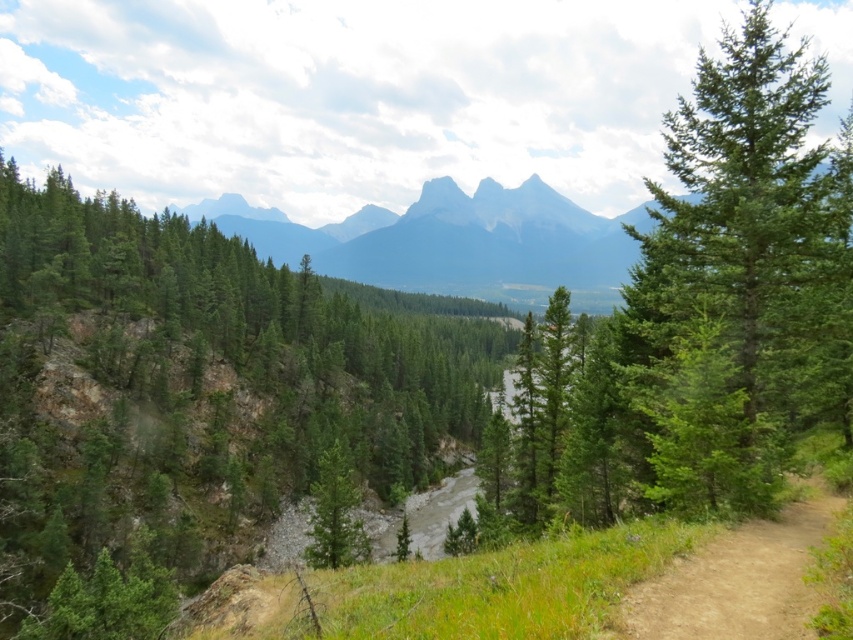
Question: Among these points, which one is farthest from the camera?

Choices:
 (A) (709, 186)
 (B) (804, 500)
 (C) (334, 493)

Answer: (C)

Question: Does green evergreen tree at right have a larger size compared to gray rocky mountain at center?

Choices:
 (A) yes
 (B) no

Answer: (B)

Question: Does green evergreen tree at right appear over gray rocky mountain at center?

Choices:
 (A) no
 (B) yes

Answer: (B)

Question: Which object is farther from the camera taking this photo?

Choices:
 (A) gray rocky mountain at center
 (B) green matte tree at center
 (C) green evergreen tree at right
 (D) brown dirt track at lower right

Answer: (B)

Question: Can you confirm if green evergreen tree at right is positioned below gray rocky mountain at center?

Choices:
 (A) no
 (B) yes

Answer: (A)

Question: Which of the following is the closest to the observer?

Choices:
 (A) (614, 632)
 (B) (422, 273)

Answer: (A)